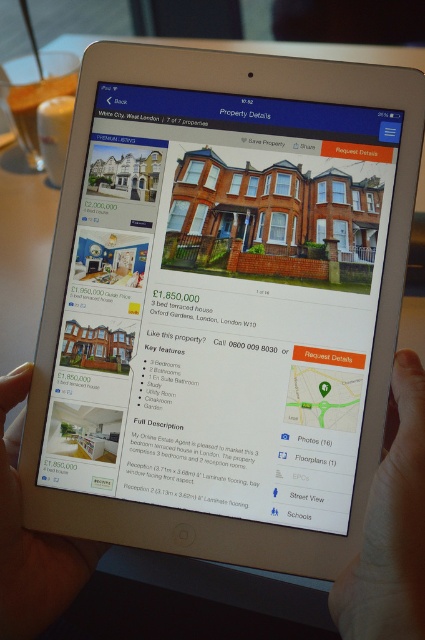
Question: Which object appears closest to the camera in this image?

Choices:
 (A) matte black tablet at lower left
 (B) smooth skin hand at lower right

Answer: (B)

Question: Which object appears farthest from the camera in this image?

Choices:
 (A) matte black tablet at lower left
 (B) smooth skin hand at lower right

Answer: (A)

Question: Is smooth skin hand at lower right above matte black tablet at lower left?

Choices:
 (A) yes
 (B) no

Answer: (A)

Question: Which point is farther from the camera taking this photo?

Choices:
 (A) (27, 566)
 (B) (353, 621)

Answer: (A)

Question: Can you confirm if smooth skin hand at lower right is wider than matte black tablet at lower left?

Choices:
 (A) yes
 (B) no

Answer: (B)

Question: Is smooth skin hand at lower right behind matte black tablet at lower left?

Choices:
 (A) no
 (B) yes

Answer: (A)